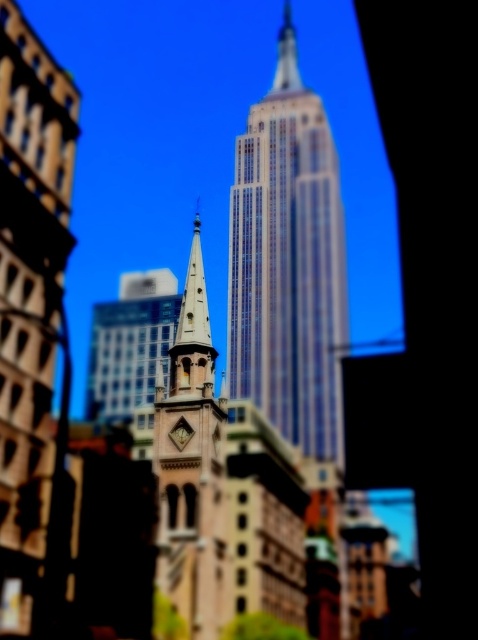
Question: Can you confirm if glassy steel skyscraper at center is bigger than beige stone clock tower at center?

Choices:
 (A) yes
 (B) no

Answer: (A)

Question: Does glassy steel skyscraper at center have a larger size compared to beige stone clock tower at center?

Choices:
 (A) yes
 (B) no

Answer: (A)

Question: Which point is farther to the camera?

Choices:
 (A) glassy steel skyscraper at center
 (B) smooth glass tower at center

Answer: (A)

Question: Which point is farther to the camera?

Choices:
 (A) beige stone clock tower at center
 (B) glassy steel skyscraper at center
 (C) smooth glass tower at center

Answer: (B)

Question: Which is nearer to the smooth glass tower at center?

Choices:
 (A) glassy steel skyscraper at center
 (B) beige stone clock tower at center

Answer: (B)

Question: Is glassy steel skyscraper at center below beige stone clock tower at center?

Choices:
 (A) no
 (B) yes

Answer: (A)